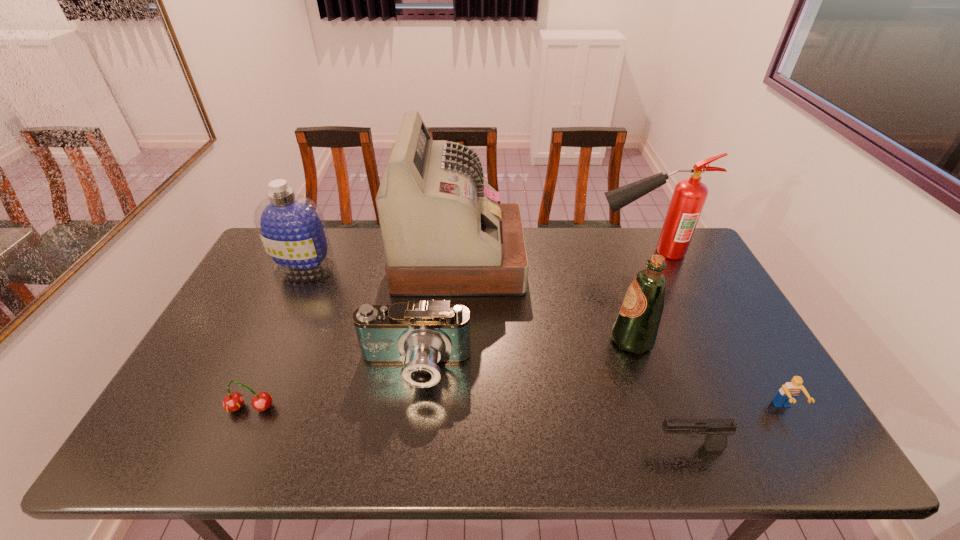
The height and width of the screenshot is (540, 960). I want to click on object that is at the far left corner, so click(x=292, y=229).

At what (x,y) coordinates should I click in order to perform the action: click on object that is at the far right corner. Please return your answer as a coordinate pair (x, y). Looking at the image, I should click on (689, 196).

This screenshot has width=960, height=540. In the image, there is a desktop. In order to click on free space at the far edge in this screenshot , I will do `click(591, 230)`.

In the image, there is a desktop. Where is `blank space at the near edge`? Image resolution: width=960 pixels, height=540 pixels. blank space at the near edge is located at coordinates (579, 438).

Find the location of a particular element. Image resolution: width=960 pixels, height=540 pixels. blank space at the left edge of the desktop is located at coordinates (294, 282).

Locate an element on the screen. vacant space at the right edge is located at coordinates (673, 292).

Locate an element on the screen. free area in between the pistol and the cleansing agent is located at coordinates (496, 357).

This screenshot has width=960, height=540. Identify the location of vacant space that is in between the cherry and the olive oil. (442, 374).

The height and width of the screenshot is (540, 960). I want to click on free spot between the olive oil and the cherry, so pos(442,374).

At what (x,y) coordinates should I click in order to perform the action: click on unoccupied position between the cash register and the pistol. Please return your answer as a coordinate pair (x, y). Looking at the image, I should click on (574, 354).